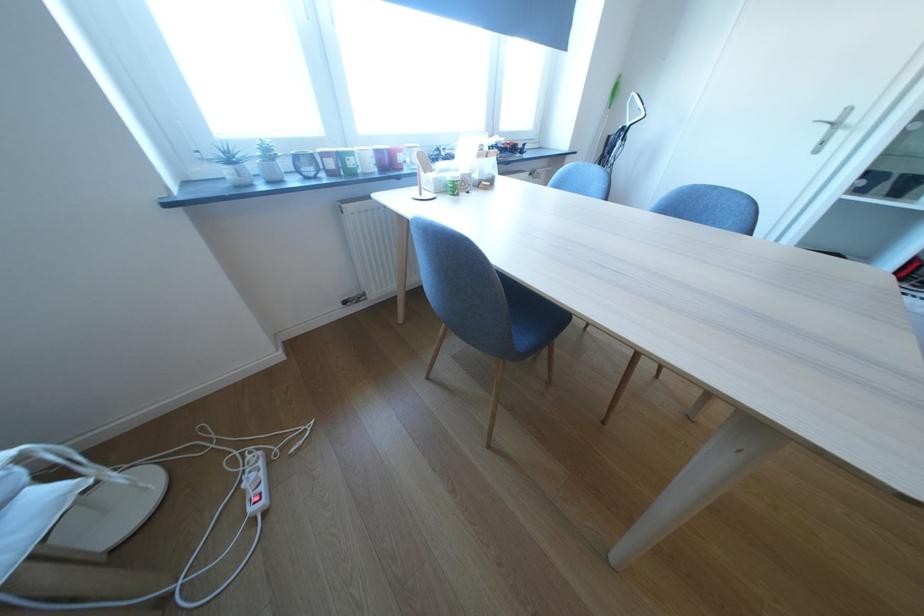
The width and height of the screenshot is (924, 616). Find the location of `umbrella handle`. umbrella handle is located at coordinates (629, 113).